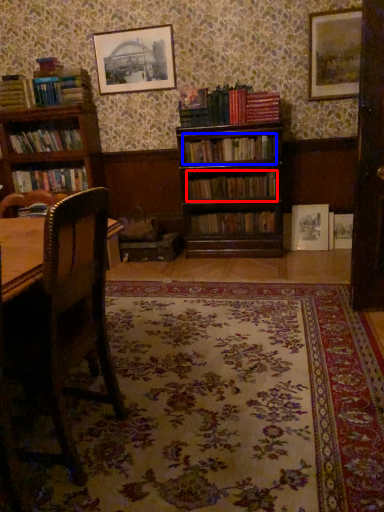
Question: Which object appears farthest to the camera in this image, book (highlighted by a red box) or book (highlighted by a blue box)?

Choices:
 (A) book
 (B) book

Answer: (A)